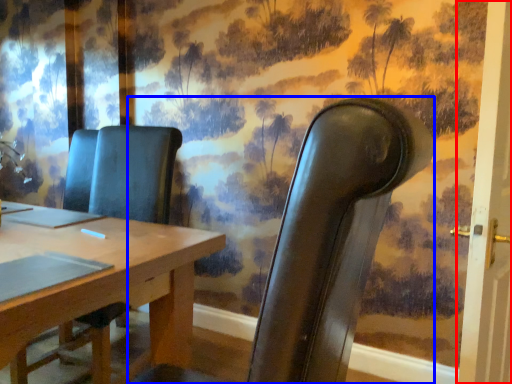
Question: Which of the following is the farthest to the observer, door (highlighted by a red box) or chair (highlighted by a blue box)?

Choices:
 (A) door
 (B) chair

Answer: (A)